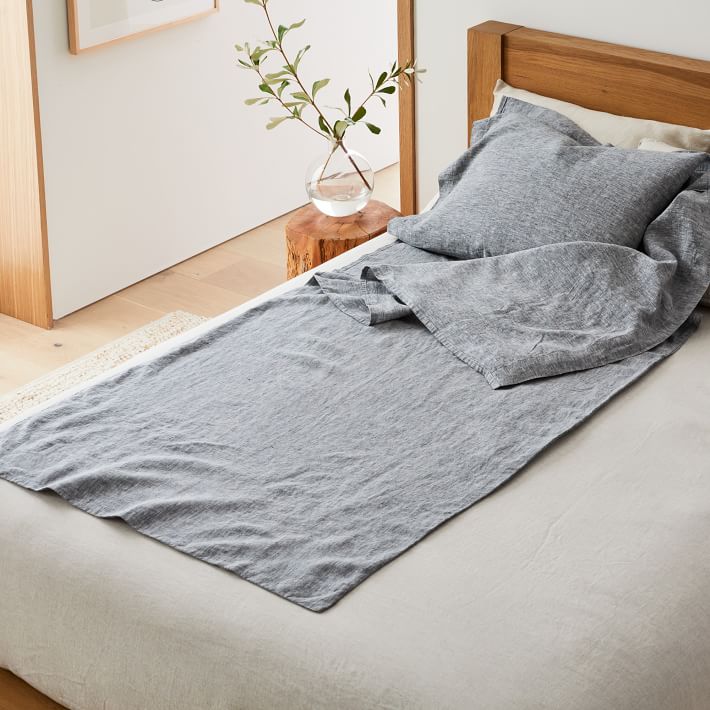
Locate an element on the screen. This screenshot has height=710, width=710. headboard is located at coordinates (479, 70), (588, 79).